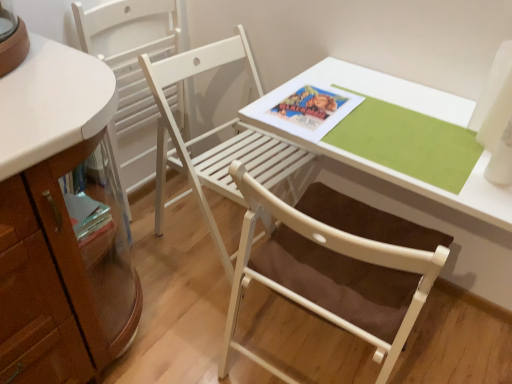
Question: Can you confirm if white wood chair at center, acting as the first chair starting from the right, is taller than white wood chair at left, the second chair when ordered from right to left?

Choices:
 (A) no
 (B) yes

Answer: (A)

Question: From a real-world perspective, is white wood chair at center, acting as the first chair starting from the right, physically above white wood chair at left, positioned as the 1th chair in left-to-right order?

Choices:
 (A) no
 (B) yes

Answer: (A)

Question: Is white wood chair at center, the second chair from the left, to the right of white wood chair at left, positioned as the 1th chair in left-to-right order, from the viewer's perspective?

Choices:
 (A) yes
 (B) no

Answer: (A)

Question: Is white wood chair at center, the second chair from the left, bigger than white wood chair at left, positioned as the 1th chair in left-to-right order?

Choices:
 (A) no
 (B) yes

Answer: (B)

Question: Is white wood chair at center, the second chair from the left, looking in the opposite direction of white wood chair at left, the second chair when ordered from right to left?

Choices:
 (A) no
 (B) yes

Answer: (B)

Question: Could you tell me if white wood chair at center, the second chair from the left, is facing white wood chair at left, positioned as the 1th chair in left-to-right order?

Choices:
 (A) yes
 (B) no

Answer: (B)

Question: Considering the relative positions of white wood chair at left, positioned as the 1th chair in left-to-right order, and white wood chair at center, acting as the first chair starting from the right, in the image provided, is white wood chair at left, positioned as the 1th chair in left-to-right order, to the left of white wood chair at center, acting as the first chair starting from the right, from the viewer's perspective?

Choices:
 (A) no
 (B) yes

Answer: (B)

Question: Is white wood chair at left, the second chair when ordered from right to left, shorter than white wood chair at center, the second chair from the left?

Choices:
 (A) no
 (B) yes

Answer: (A)

Question: Is white wood chair at left, the second chair when ordered from right to left, not near white wood chair at center, the second chair from the left?

Choices:
 (A) no
 (B) yes

Answer: (A)

Question: Considering the relative sizes of white wood chair at left, positioned as the 1th chair in left-to-right order, and white wood chair at center, the second chair from the left, in the image provided, is white wood chair at left, positioned as the 1th chair in left-to-right order, bigger than white wood chair at center, the second chair from the left,?

Choices:
 (A) no
 (B) yes

Answer: (A)

Question: From the image's perspective, is white wood chair at left, the second chair when ordered from right to left, beneath white wood chair at center, acting as the first chair starting from the right?

Choices:
 (A) no
 (B) yes

Answer: (A)

Question: Is white wood chair at left, the second chair when ordered from right to left, positioned behind white wood chair at center, the second chair from the left?

Choices:
 (A) yes
 (B) no

Answer: (A)

Question: From a real-world perspective, is white wood chair at center, the second chair from the left, physically below white wood table at center?

Choices:
 (A) no
 (B) yes

Answer: (B)